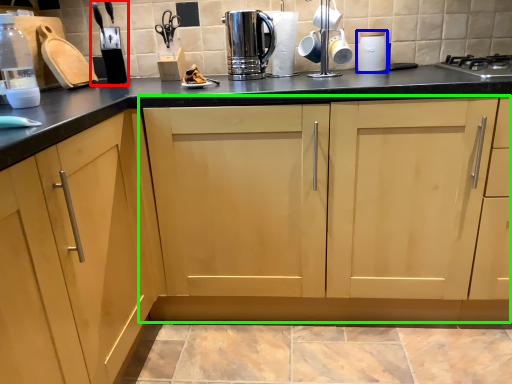
Question: Considering the real-world distances, which object is closest to appliance (highlighted by a red box)? appliance (highlighted by a blue box) or cabinetry (highlighted by a green box).

Choices:
 (A) appliance
 (B) cabinetry

Answer: (B)